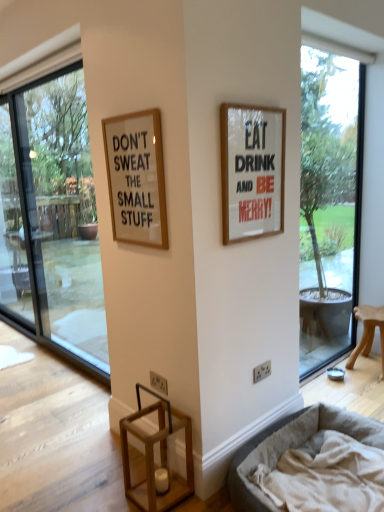
The image size is (384, 512). I want to click on free location above transparent glass window at right, arranged as the second window when viewed from the left (from a real-world perspective), so click(331, 51).